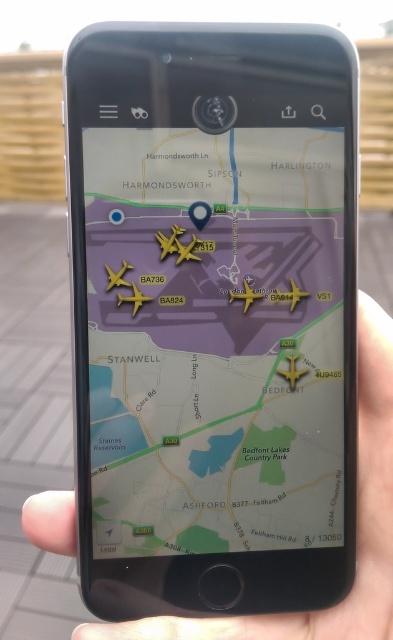
You are holding a black matte smartphone at center and want to place a matte gold airplane at center on it. The airplane requires at least 4 inches of space to land safely. Based on the map displayed, can the airplane land on the smartphone screen?

The distance between the black matte smartphone at center and the matte gold airplane at center is 3.92 inches, which is less than the required 4 inches. Therefore, the airplane cannot land safely on the smartphone screen.

You are looking at a smartphone displaying a map of London with Heathrow Airport and surrounding areas. The smartphone is located at point (x=213, y=316). If you want to check the location of Harmondsworth, which is to the north of Heathrow Airport, should you pan the map upwards or downwards?

Since Harmondsworth is to the north of Heathrow Airport and the smartphone is at point (x=213, y=316), you should pan the map downwards to see Harmondsworth because moving the map downward reveals northern areas.